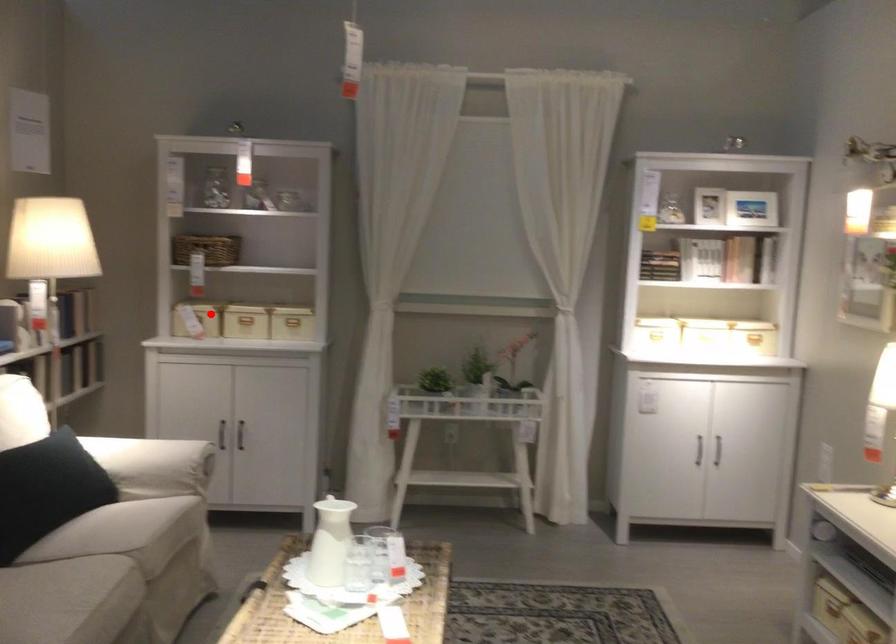
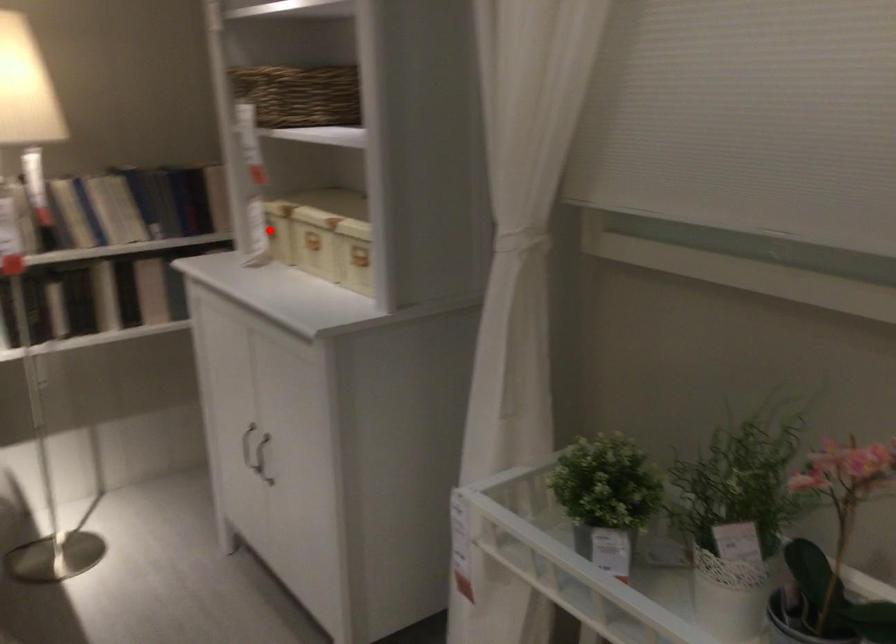
I am providing you with two images of the same scene from different viewpoints. A red point is marked on the first image and another point is marked on the second image. Does the point marked in image1 correspond to the same location as the one in image2?

Yes